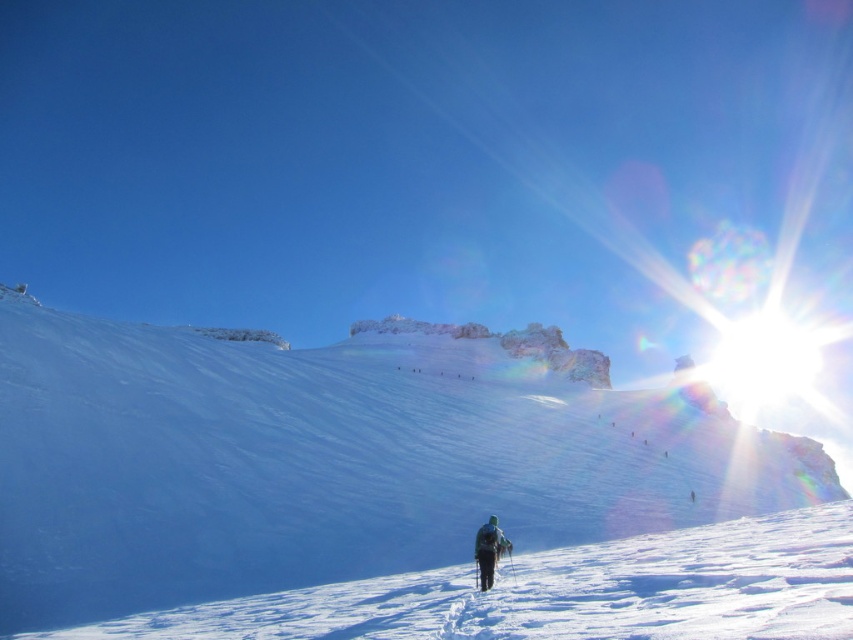
Question: Does white powdery snow at center appear over white snow at center?

Choices:
 (A) no
 (B) yes

Answer: (B)

Question: Is white snow at center closer to camera compared to dark green fabric jacket at lower center?

Choices:
 (A) no
 (B) yes

Answer: (B)

Question: Which point appears closest to the camera in this image?

Choices:
 (A) (491, 516)
 (B) (590, 573)
 (C) (401, 422)

Answer: (B)

Question: Which object appears farthest from the camera in this image?

Choices:
 (A) white powdery snow at center
 (B) dark green fabric jacket at lower center
 (C) white snow at center

Answer: (B)

Question: Is white snow at center to the right of dark green fabric jacket at lower center from the viewer's perspective?

Choices:
 (A) no
 (B) yes

Answer: (B)

Question: Which of the following is the farthest from the observer?

Choices:
 (A) (570, 349)
 (B) (537, 554)

Answer: (A)